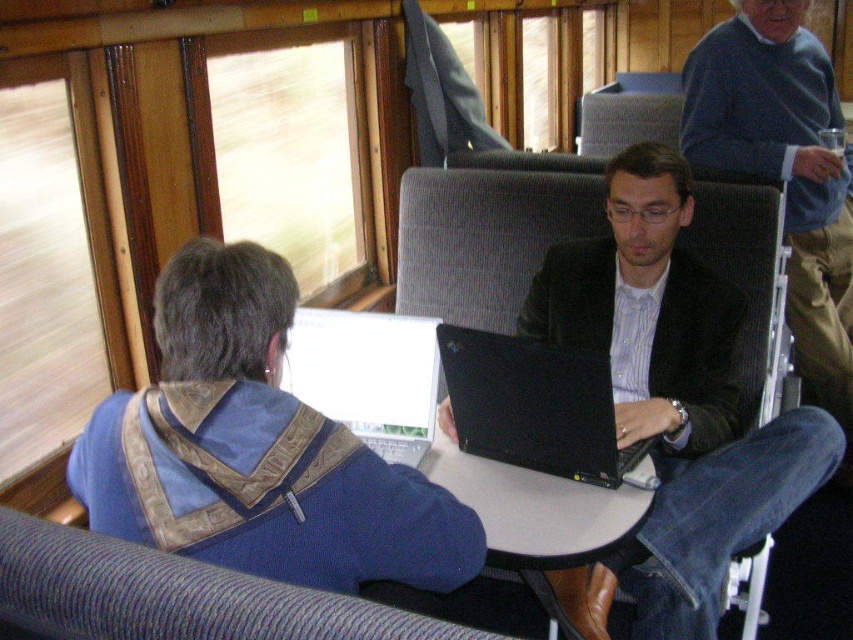
You are a passenger on a moving train and you want to place your phone on the table without blocking the laptop. Given the black matte laptop at center and the white plastic table at center, is there enough space on the table for both items?

The black matte laptop at center occupies less space than white plastic table at center, so there is enough space on the white plastic table at center to place both the laptop and your phone without blocking each other.

You are a traveler who wants to place a 12 inch by 12 inch square box on the white plastic table at center. The box needs to be placed next to the white glossy laptop at center without overlapping. Is there enough space on the table for this?

The white plastic table at center might be wider than white glossy laptop at center, so there could be enough space to place the box next to the laptop without overlapping. However, the exact dimensions aren t specified, so it s uncertain.

You are a passenger in the train carriage and want to place your bag on the blue corduroy coach at upper right. However, you need to check if it is closer to you than the black matte laptop at center. Can you determine which one is closer?

The blue corduroy coach at upper right is further to the viewer than the black matte laptop at center, so the laptop is closer to you. Therefore, the coach is farther away, so placing your bag there might require reaching over the laptop.